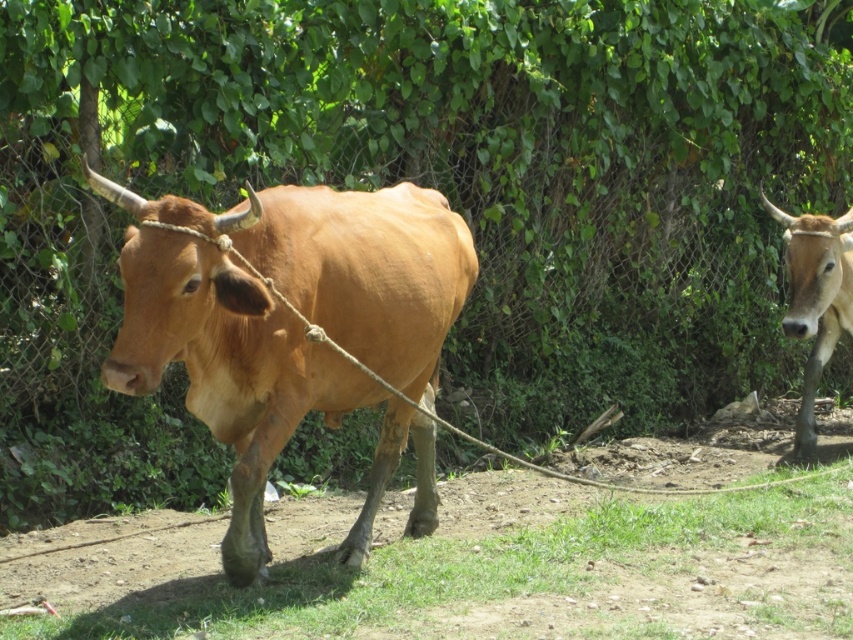
Question: Is green grass at lower center to the left of shiny brown bull at center from the viewer's perspective?

Choices:
 (A) no
 (B) yes

Answer: (A)

Question: Can you confirm if green grass at lower center is positioned to the right of brown glossy cow at right?

Choices:
 (A) yes
 (B) no

Answer: (B)

Question: Is green grass at lower center wider than brown glossy cow at right?

Choices:
 (A) no
 (B) yes

Answer: (B)

Question: Which object is the farthest from the brown glossy cow at right?

Choices:
 (A) green grass at lower center
 (B) shiny brown bull at center

Answer: (B)

Question: Which object is positioned farthest from the brown glossy cow at right?

Choices:
 (A) shiny brown bull at center
 (B) green grass at lower center

Answer: (A)

Question: Which object is farther from the camera taking this photo?

Choices:
 (A) brown glossy cow at right
 (B) shiny brown bull at center
 (C) green grass at lower center

Answer: (A)